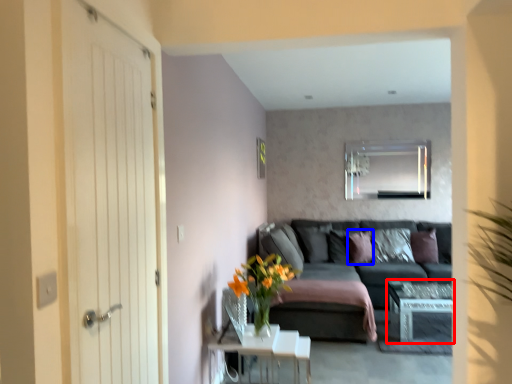
Question: Which of the following is the closest to the observer, table (highlighted by a red box) or pillow (highlighted by a blue box)?

Choices:
 (A) table
 (B) pillow

Answer: (A)